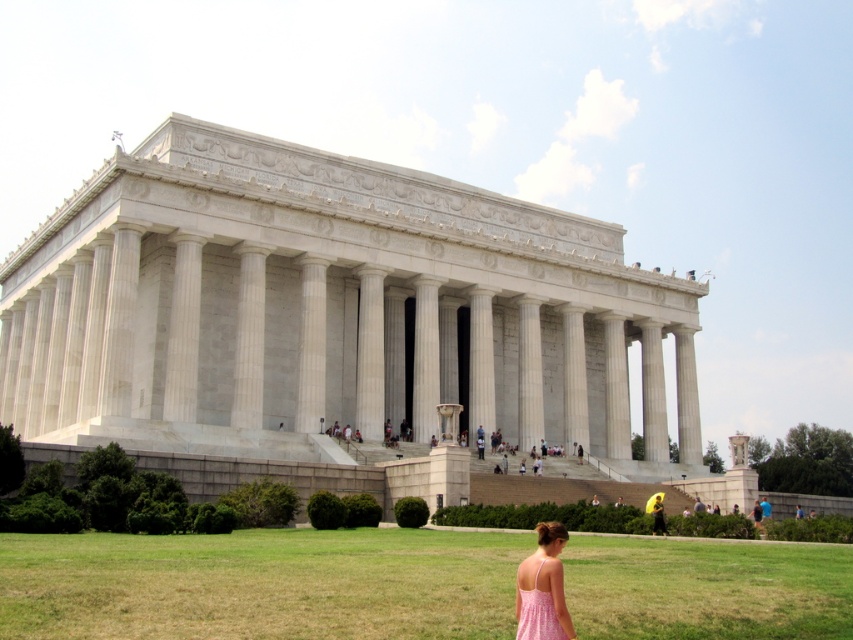
Between point (480, 589) and point (537, 596), which one is positioned in front?

Point (537, 596)

Does point (782, 614) come in front of point (521, 604)?

No.

This screenshot has width=853, height=640. In order to click on green grass at lower center in this screenshot , I will do `click(260, 582)`.

Can you confirm if green grass at lower center is thinner than pink fabric dress at lower center?

In fact, green grass at lower center might be wider than pink fabric dress at lower center.

Looking at this image, between green grass at lower center and pink fabric dress at lower center, which one appears on the left side from the viewer's perspective?

green grass at lower center

Where is `green grass at lower center`? This screenshot has height=640, width=853. green grass at lower center is located at coordinates (260, 582).

Does point (527, 605) come farther from viewer compared to point (663, 525)?

No.

Where is `pink floral dress at lower right`? pink floral dress at lower right is located at coordinates 537,612.